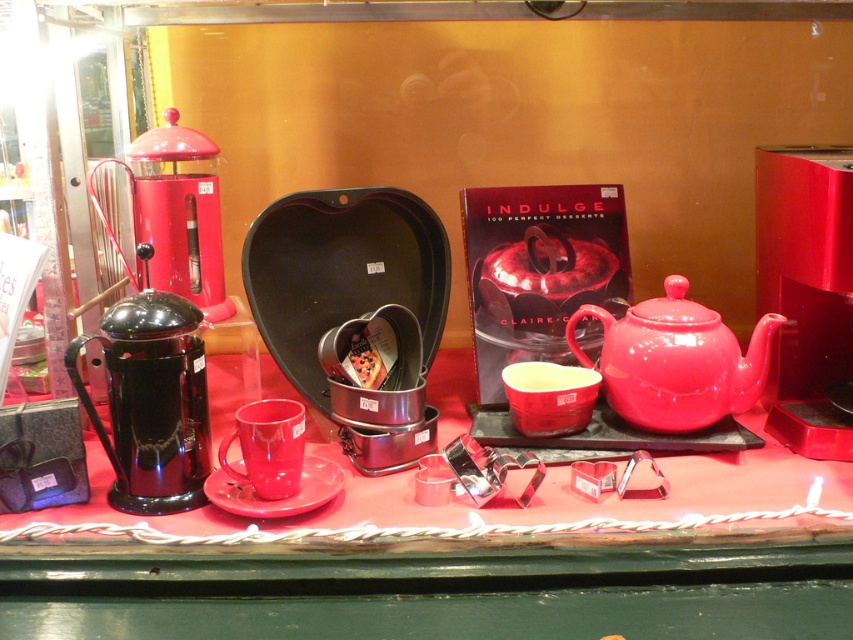
Who is shorter, black glossy coffee pot at left or glossy ceramic mug at center?

Standing shorter between the two is glossy ceramic mug at center.

Does black glossy coffee pot at left have a greater width compared to glossy ceramic mug at center?

Yes, black glossy coffee pot at left is wider than glossy ceramic mug at center.

Find the location of a particular element. black glossy coffee pot at left is located at coordinates (151, 400).

Where is `black glossy coffee pot at left`? The width and height of the screenshot is (853, 640). black glossy coffee pot at left is located at coordinates (151, 400).

Which is behind, point (630, 584) or point (296, 483)?

Point (296, 483)

Does glossy ceramic table at center appear on the left side of glossy ceramic mug at center?

Incorrect, glossy ceramic table at center is not on the left side of glossy ceramic mug at center.

Is point (421, 595) positioned in front of point (260, 493)?

Yes, it is.

Locate an element on the screen. This screenshot has height=640, width=853. glossy ceramic table at center is located at coordinates (437, 586).

Between matte ceramic teapot at center-right and glossy ceramic mug at center, which one is positioned lower?

glossy ceramic mug at center

Is matte ceramic teapot at center-right further to camera compared to glossy ceramic mug at center?

Yes, it is.

Does point (729, 337) lie behind point (303, 445)?

Yes, it is behind point (303, 445).

The image size is (853, 640). In order to click on matte ceramic teapot at center-right in this screenshot , I will do `click(675, 360)`.